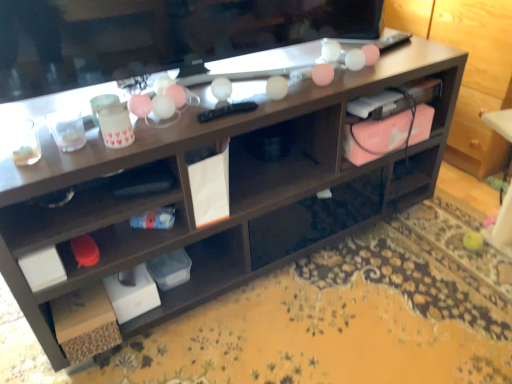
Question: In terms of width, does pink matte laptop at right look wider or thinner when compared to matte black television at upper center?

Choices:
 (A) thin
 (B) wide

Answer: (A)

Question: From the image's perspective, is pink matte laptop at right positioned above or below matte black television at upper center?

Choices:
 (A) below
 (B) above

Answer: (A)

Question: Visually, is pink matte laptop at right positioned to the left or to the right of matte black television at upper center?

Choices:
 (A) right
 (B) left

Answer: (A)

Question: Considering the positions of matte black television at upper center and pink matte laptop at right in the image, is matte black television at upper center taller or shorter than pink matte laptop at right?

Choices:
 (A) short
 (B) tall

Answer: (B)

Question: Based on their positions, is matte black television at upper center located to the left or right of pink matte laptop at right?

Choices:
 (A) right
 (B) left

Answer: (B)

Question: From a real-world perspective, is matte black television at upper center positioned above or below pink matte laptop at right?

Choices:
 (A) above
 (B) below

Answer: (A)

Question: Considering their positions, is matte black television at upper center located in front of or behind pink matte laptop at right?

Choices:
 (A) behind
 (B) front

Answer: (B)